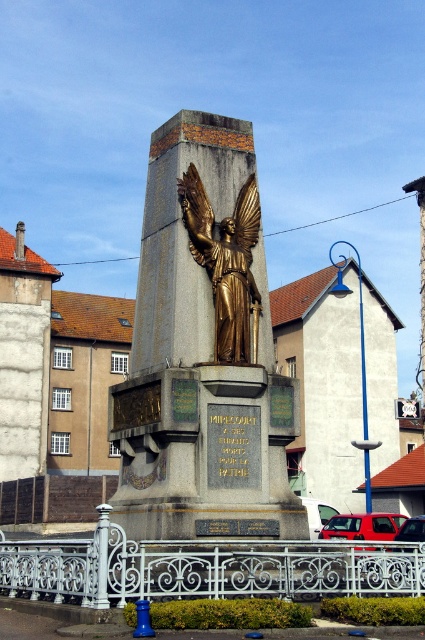
Question: Which point is farther to the camera?

Choices:
 (A) gold polished statue at center
 (B) gold-bronze angel at center

Answer: (B)

Question: Can you confirm if gold polished statue at center is positioned to the right of gold-bronze angel at center?

Choices:
 (A) no
 (B) yes

Answer: (A)

Question: Is gold polished statue at center below gold-bronze angel at center?

Choices:
 (A) no
 (B) yes

Answer: (A)

Question: Which object appears closest to the camera in this image?

Choices:
 (A) gold-bronze angel at center
 (B) gold polished statue at center

Answer: (B)

Question: Does gold polished statue at center have a smaller size compared to gold-bronze angel at center?

Choices:
 (A) yes
 (B) no

Answer: (B)